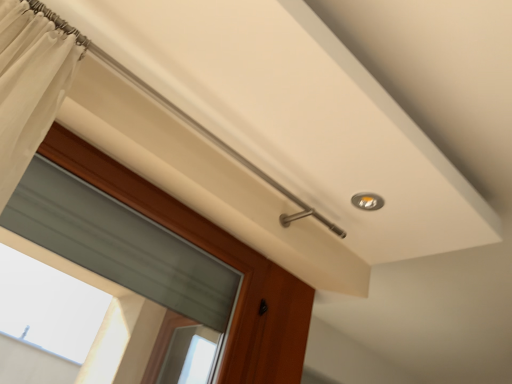
Describe the element at coordinates (217, 257) in the screenshot. I see `clear glass window at upper left` at that location.

Where is `clear glass window at upper left`? This screenshot has height=384, width=512. clear glass window at upper left is located at coordinates (217, 257).

Identify the location of clear glass window at upper left. (217, 257).